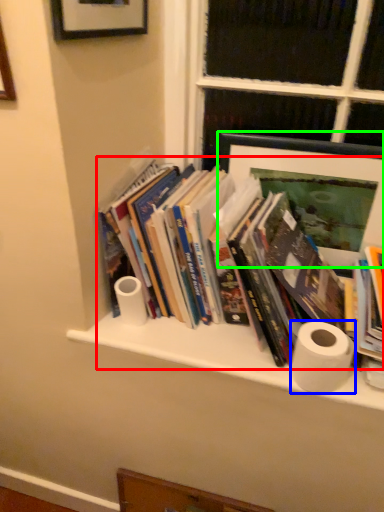
Question: Estimate the real-world distances between objects in this image. Which object is farther from book (highlighted by a red box), toilet paper (highlighted by a blue box) or picture frame (highlighted by a green box)?

Choices:
 (A) toilet paper
 (B) picture frame

Answer: (A)